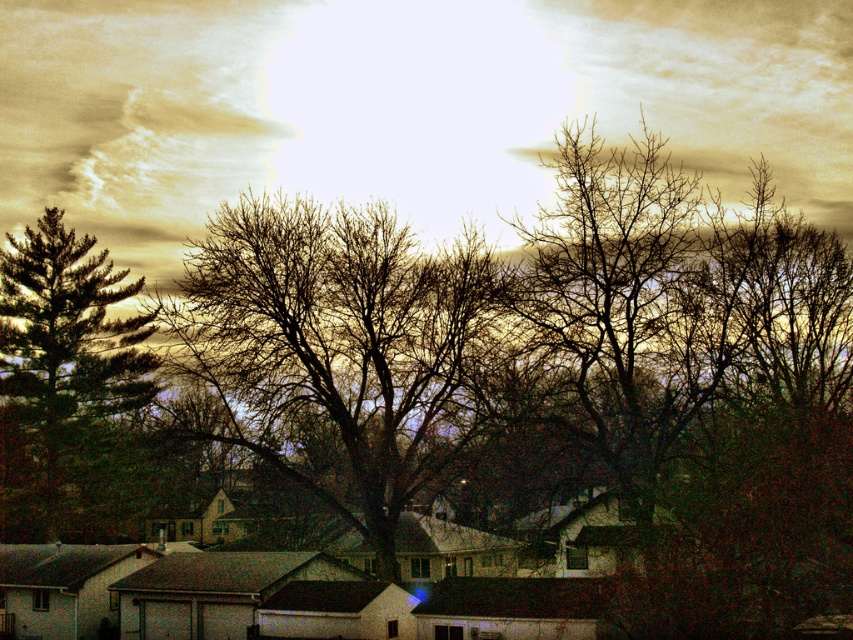
Question: Can you confirm if white cotton cloud at upper center is wider than bare branches at center?

Choices:
 (A) yes
 (B) no

Answer: (A)

Question: Which point appears farthest from the camera in this image?

Choices:
 (A) (430, 72)
 (B) (36, 468)

Answer: (B)

Question: Which of the following is the closest to the observer?

Choices:
 (A) (613, 90)
 (B) (93, 278)

Answer: (A)

Question: Which of the following is the closest to the observer?

Choices:
 (A) (428, 365)
 (B) (51, 492)

Answer: (A)

Question: Is bare branches at center wider than green matte tree at left?

Choices:
 (A) no
 (B) yes

Answer: (B)

Question: Is white cotton cloud at upper center closer to the viewer compared to bare branches at center?

Choices:
 (A) no
 (B) yes

Answer: (A)